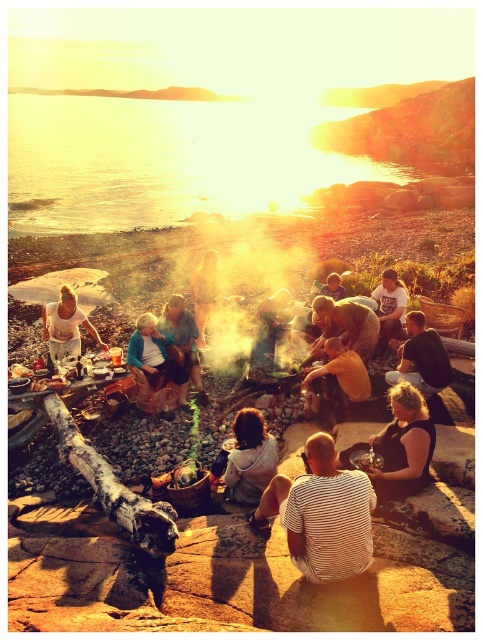
Question: Can you confirm if white striped shirt at center is thinner than black fabric woman at center?

Choices:
 (A) no
 (B) yes

Answer: (A)

Question: Considering the relative positions of white cotton shirt at center and smooth beige shirt at center in the image provided, where is white cotton shirt at center located with respect to smooth beige shirt at center?

Choices:
 (A) below
 (B) above

Answer: (A)

Question: Among these points, which one is farthest from the camera?

Choices:
 (A) (42, 317)
 (B) (377, 291)

Answer: (A)

Question: Among these points, which one is farthest from the camera?

Choices:
 (A) (363, 314)
 (B) (211, 257)

Answer: (B)

Question: Considering the relative positions of white striped shirt at center and yellow fabric bag at center in the image provided, where is white striped shirt at center located with respect to yellow fabric bag at center?

Choices:
 (A) left
 (B) right

Answer: (A)

Question: Which of the following is the farthest from the observer?

Choices:
 (A) (255, 349)
 (B) (356, 369)

Answer: (A)